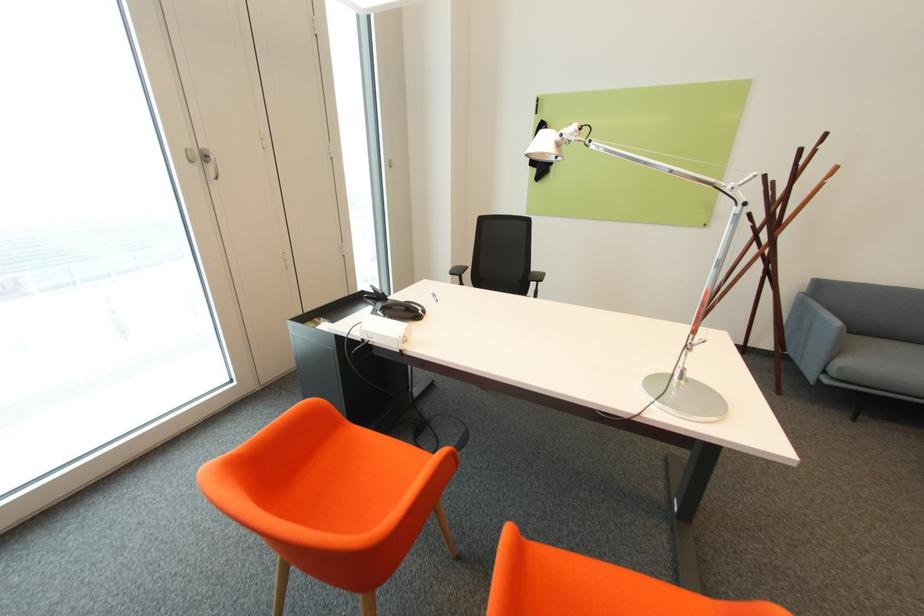
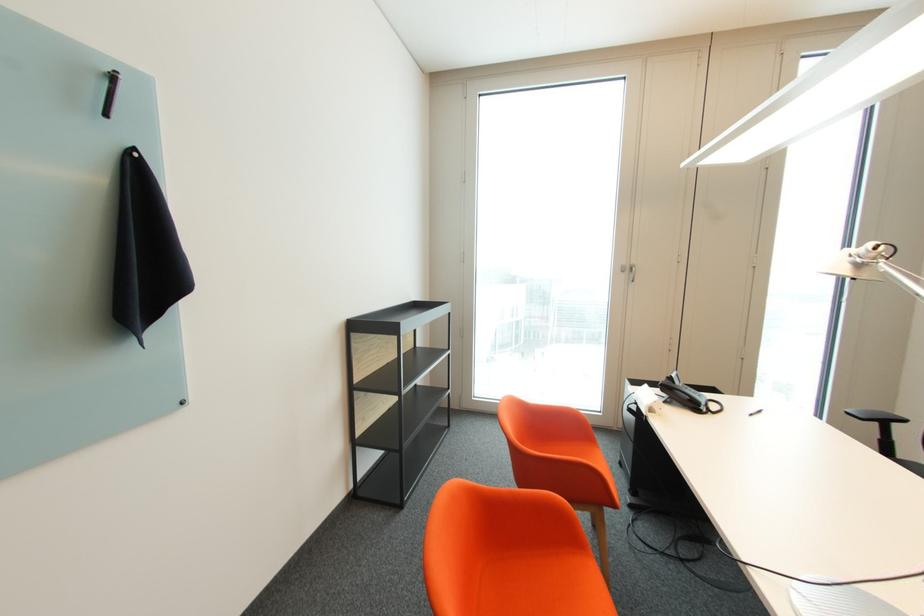
Where in the second image is the point corresponding to the point at 568,136 from the first image?

(860, 256)